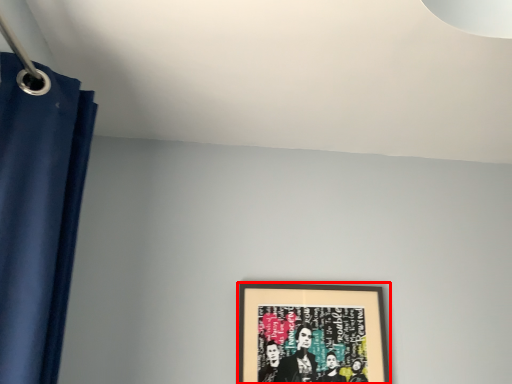
Question: From the image's perspective, what is the correct spatial positioning of picture frame (annotated by the red box) in reference to curtain?

Choices:
 (A) above
 (B) below

Answer: (B)